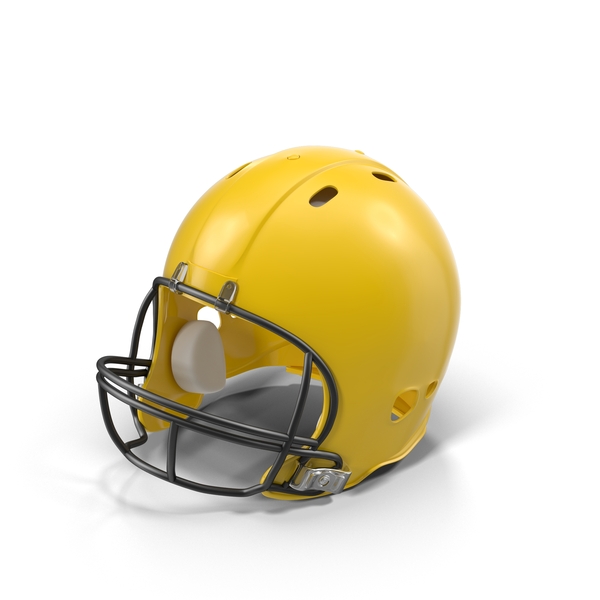
At what (x,y) coordinates should I click in order to perform the action: click on padding. Please return your answer as a coordinate pair (x, y). Image resolution: width=600 pixels, height=600 pixels. Looking at the image, I should click on (214, 367).